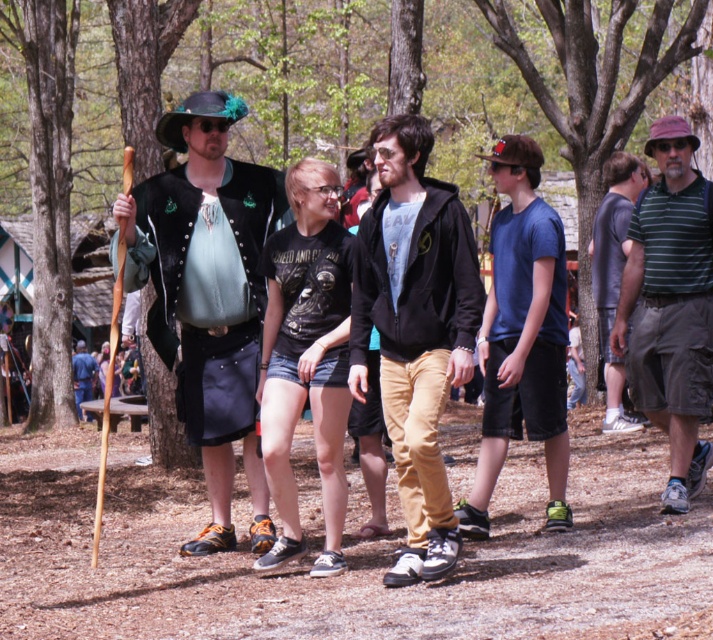
Question: From the image, what is the correct spatial relationship of matte black vest at center in relation to dark gray t-shirt at right?

Choices:
 (A) below
 (B) above

Answer: (A)

Question: Observing the image, what is the correct spatial positioning of green striped polo shirt at right in reference to dark gray t-shirt at right?

Choices:
 (A) above
 (B) below

Answer: (B)

Question: From the image, what is the correct spatial relationship of matte black vest at center in relation to green striped polo shirt at right?

Choices:
 (A) below
 (B) above

Answer: (A)

Question: Which point is farther to the camera?

Choices:
 (A) dark gray t-shirt at right
 (B) green striped polo shirt at right
 (C) blue cotton t-shirt at center

Answer: (A)

Question: Among these points, which one is nearest to the camera?

Choices:
 (A) (361, 353)
 (B) (210, 330)
 (C) (607, 369)
 (D) (86, 396)

Answer: (A)

Question: Which point appears farthest from the camera in this image?

Choices:
 (A) (451, 264)
 (B) (508, 273)
 (C) (617, 394)
 (D) (650, 324)

Answer: (C)